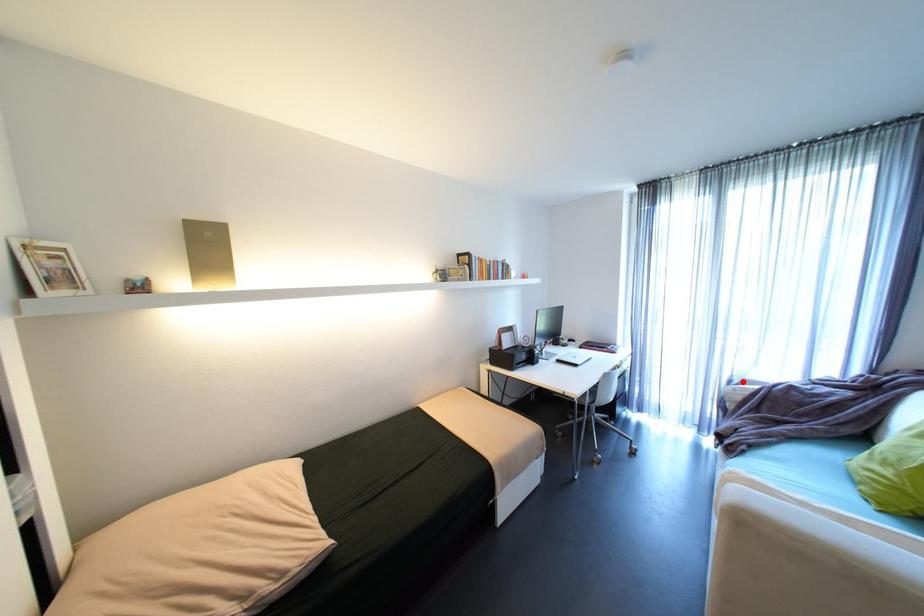
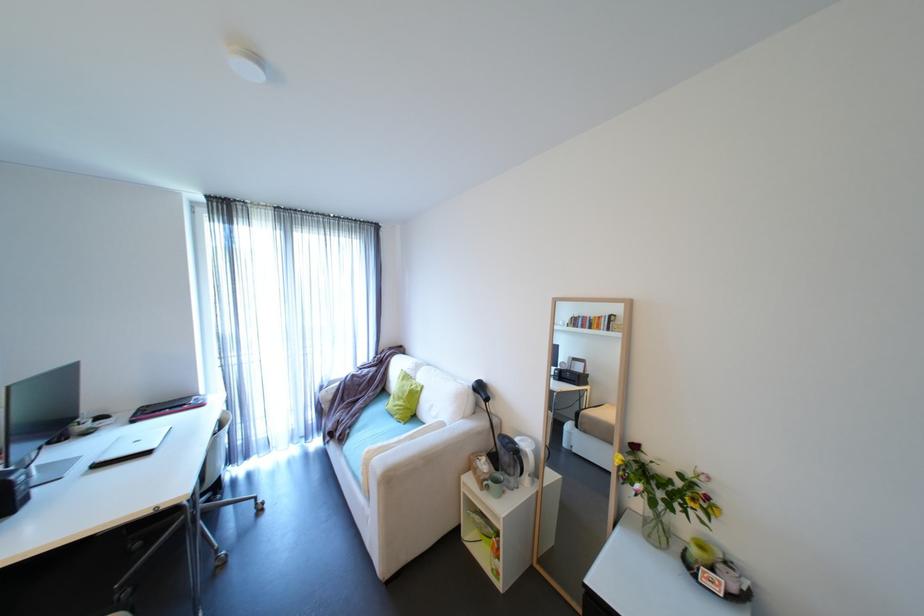
In the second image, find the point that corresponds to the highlighted location in the first image.

(333, 386)